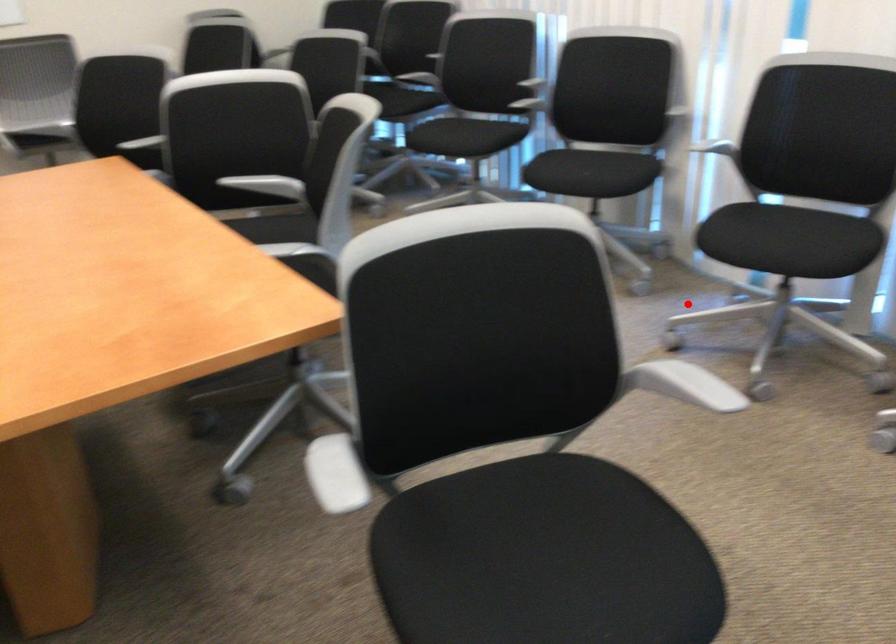
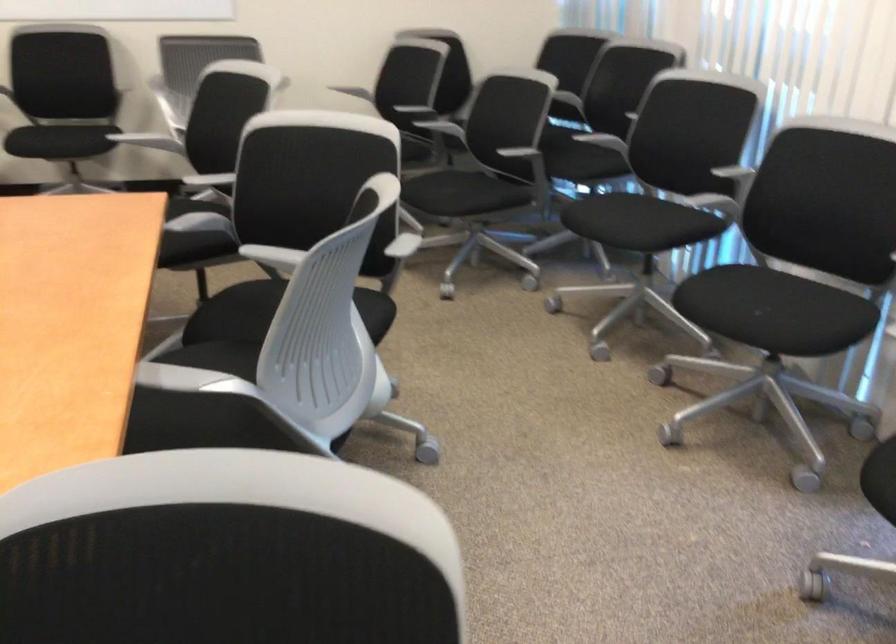
Question: A red point is marked in image1. In image2, is the corresponding 3D point closer to the camera or farther? Reply with the corresponding letter.

Choices:
 (A) The corresponding 3D point is closer.
 (B) The corresponding 3D point is farther.

Answer: (A)